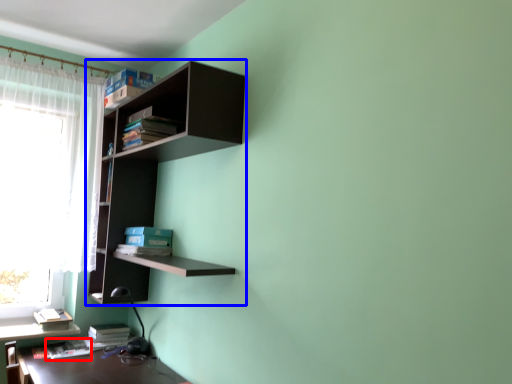
Question: Which point is further to the camera, book (highlighted by a red box) or shelf (highlighted by a blue box)?

Choices:
 (A) book
 (B) shelf

Answer: (A)